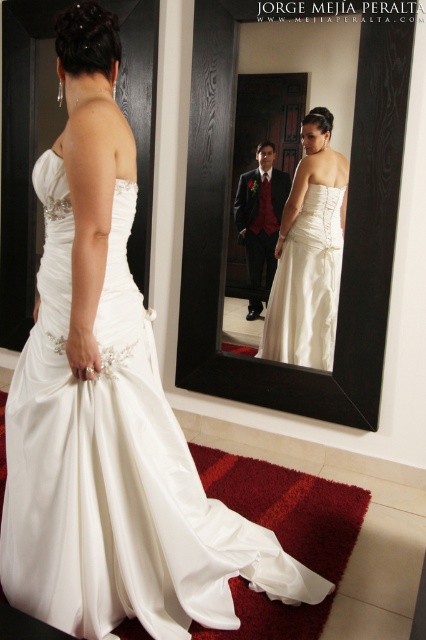
Between point (149, 428) and point (331, 330), which one is positioned in front?

Point (149, 428) is in front.

Between white satin dress at center and satin/smooth dress at center, which one appears on the left side from the viewer's perspective?

white satin dress at center is more to the left.

Does point (100, 480) lie behind point (273, 305)?

No, (100, 480) is closer to viewer.

The image size is (426, 640). Find the location of `white satin dress at center`. white satin dress at center is located at coordinates (115, 468).

Can you confirm if black frame mirror at center is positioned below satin/velvet suit at center?

Incorrect, black frame mirror at center is not positioned below satin/velvet suit at center.

Is point (370, 205) less distant than point (284, 172)?

Yes, point (370, 205) is in front of point (284, 172).

Is point (224, 68) farther from viewer compared to point (270, 186)?

No, (224, 68) is closer to viewer.

Identify the location of black frame mirror at center. (345, 234).

Does point (180, 568) lie behind point (238, 202)?

No, it is not.

Is white satin dress at center below satin/velvet suit at center?

Correct, white satin dress at center is located below satin/velvet suit at center.

This screenshot has width=426, height=640. What are the coordinates of `white satin dress at center` in the screenshot? It's located at (115, 468).